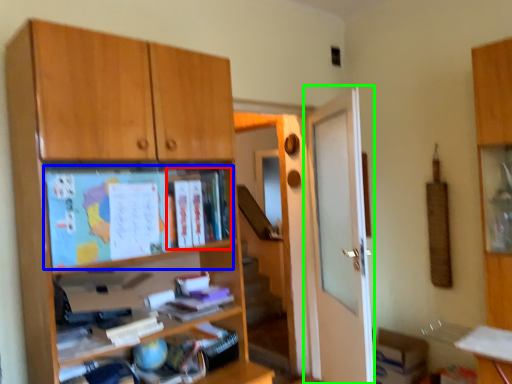
Question: Considering the real-world distances, which object is closest to book (highlighted by a red box)? paperback book (highlighted by a blue box) or door (highlighted by a green box).

Choices:
 (A) paperback book
 (B) door

Answer: (A)